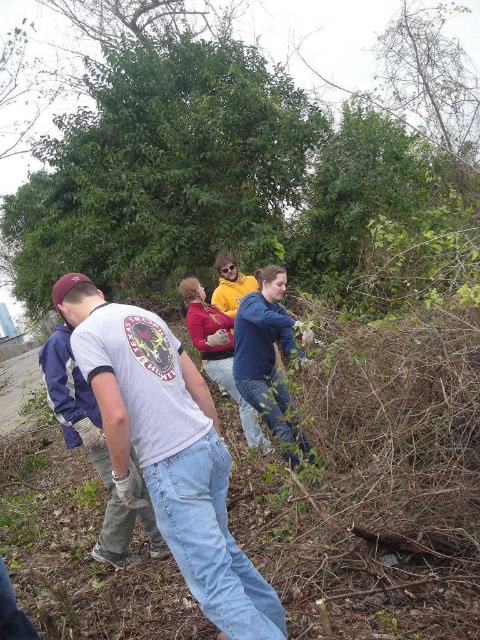
You are a photographer trying to capture a clear shot of the matte yellow sweater at center and the green leafy tree at center. Which object is blocking the view of the other?

The matte yellow sweater at center is behind the green leafy tree at center, so the green leafy tree at center is blocking the view of the matte yellow sweater at center.

You are a photographer trying to capture a photo of the green leafy tree at center and the matte yellow sweater at center in the same frame. Based on their sizes, which object would appear larger in the photo?

The green leafy tree at center would appear larger in the photo since it is much taller than the matte yellow sweater at center.